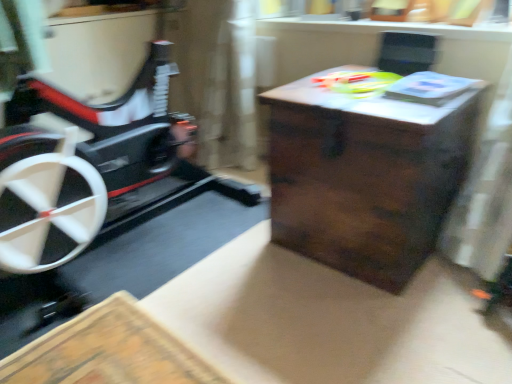
Find the location of a particular element. The height and width of the screenshot is (384, 512). free space to the left of dark wood table at center is located at coordinates (223, 251).